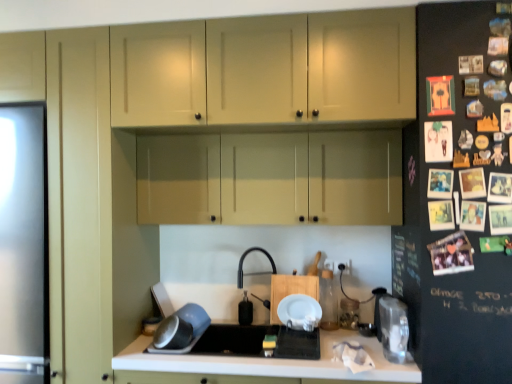
Question: Does point (225, 332) appear closer or farther from the camera than point (146, 359)?

Choices:
 (A) closer
 (B) farther

Answer: (B)

Question: Is black matte sink at center inside or outside of white matte countertop at center?

Choices:
 (A) outside
 (B) inside

Answer: (B)

Question: Estimate the real-world distances between objects in this image. Which object is farther from the metallic silver bowl at lower left, placed as the first appliance when sorted from left to right?

Choices:
 (A) transparent plastic container at right, which is the third appliance from left to right
 (B) white matte countertop at center
 (C) black matte sink at center
 (D) matte cream cabinets at upper center, acting as the first cabinetry starting from the top
 (E) translucent plastic container at center, arranged as the second appliance when viewed from the left

Answer: (D)

Question: Estimate the real-world distances between objects in this image. Which object is farther from the black rubber faucet at center?

Choices:
 (A) translucent plastic container at center, marked as the 2th appliance in a right-to-left arrangement
 (B) black matte sink at center
 (C) black matte fridge at right
 (D) white matte countertop at center
 (E) matte beige cabinets at center, the 1th cabinetry positioned from the bottom

Answer: (C)